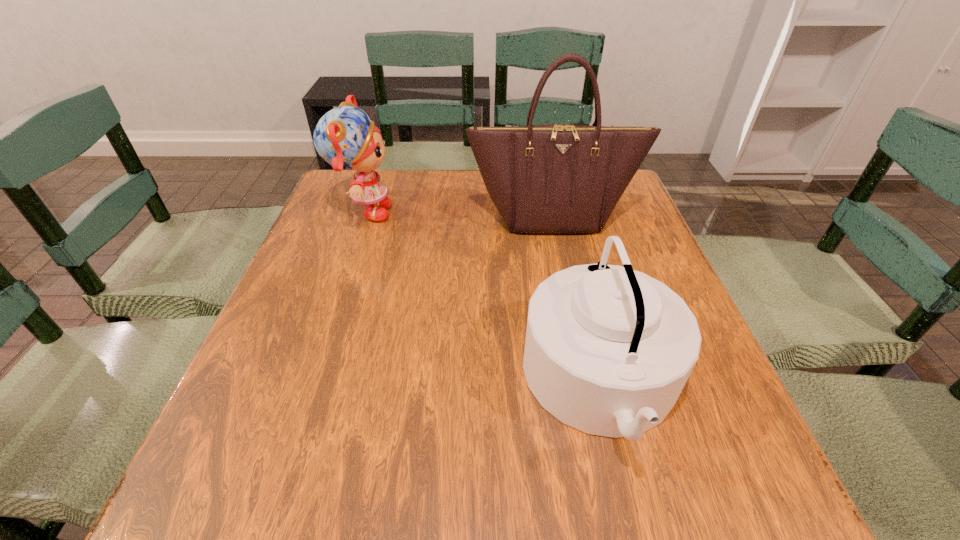
Where is `the closest object relative to the nearest object`? This screenshot has height=540, width=960. the closest object relative to the nearest object is located at coordinates (556, 178).

You are a GUI agent. You are given a task and a screenshot of the screen. Output one action in this format:
    pyautogui.click(x=<x>, y=<y>)
    Task: Click on the object that is the closest one to the leftmost object
    
    Given the screenshot: What is the action you would take?
    pyautogui.click(x=556, y=178)